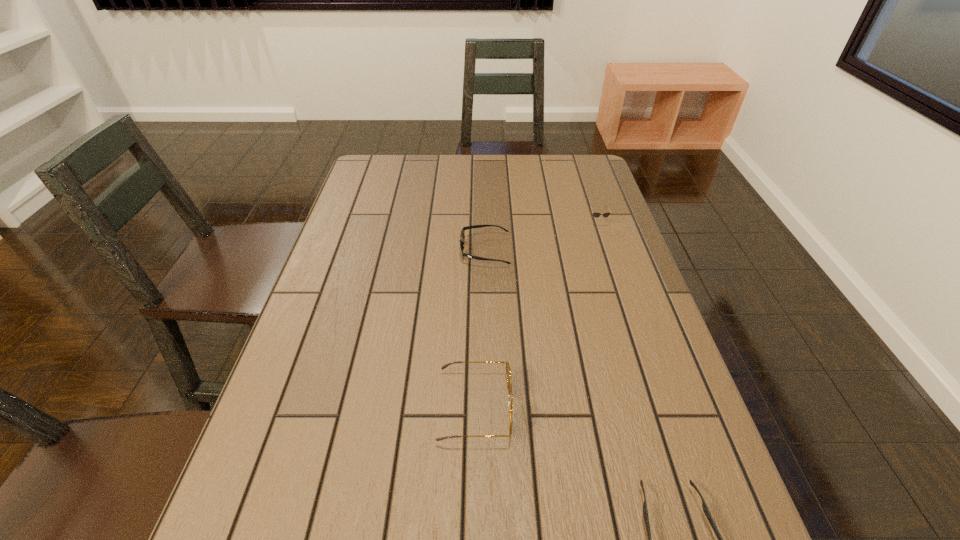
Find the location of a particular element. free space at the far edge of the desktop is located at coordinates (441, 174).

The image size is (960, 540). Find the location of `vacant space at the left edge of the desktop`. vacant space at the left edge of the desktop is located at coordinates (340, 401).

At what (x,y) coordinates should I click in order to perform the action: click on free space at the right edge of the desktop. Please return your answer as a coordinate pair (x, y). Looking at the image, I should click on (590, 234).

Find the location of a particular element. The width and height of the screenshot is (960, 540). vacant area at the far right corner is located at coordinates (584, 165).

You are a GUI agent. You are given a task and a screenshot of the screen. Output one action in this format:
    pyautogui.click(x=<x>, y=<y>)
    Task: Click on the free space between the second nearest sunglasses and the farthest sunglasses
    The height and width of the screenshot is (540, 960).
    Given the screenshot: What is the action you would take?
    (537, 314)

Locate an element on the screen. This screenshot has width=960, height=540. free area in between the third shortest object and the second nearest object is located at coordinates (537, 314).

Image resolution: width=960 pixels, height=540 pixels. What are the coordinates of `empty space that is in between the third farthest object and the third shortest object` in the screenshot? It's located at (537, 314).

At what (x,y) coordinates should I click in order to perform the action: click on free space that is in between the third shortest object and the third farthest sunglasses. Please return your answer as a coordinate pair (x, y). Looking at the image, I should click on (537, 314).

Identify which object is located as the third nearest to the nearest sunglasses. Please provide its 2D coordinates. Your answer should be formatted as a tuple, i.e. [(x, y)], where the tuple contains the x and y coordinates of a point satisfying the conditions above.

[(596, 214)]

The width and height of the screenshot is (960, 540). In order to click on object that is the closest to the third nearest object in this screenshot , I will do `click(596, 214)`.